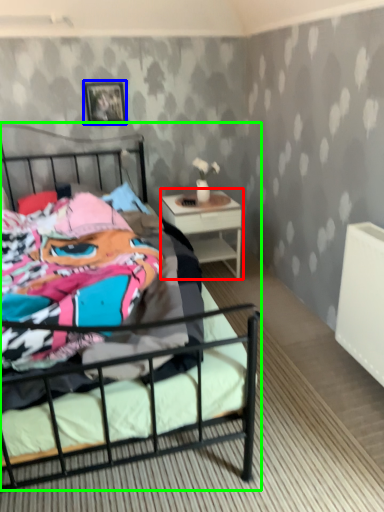
Question: Which object is the farthest from nightstand (highlighted by a red box)? Choose among these: picture frame (highlighted by a blue box) or bed (highlighted by a green box).

Choices:
 (A) picture frame
 (B) bed

Answer: (A)